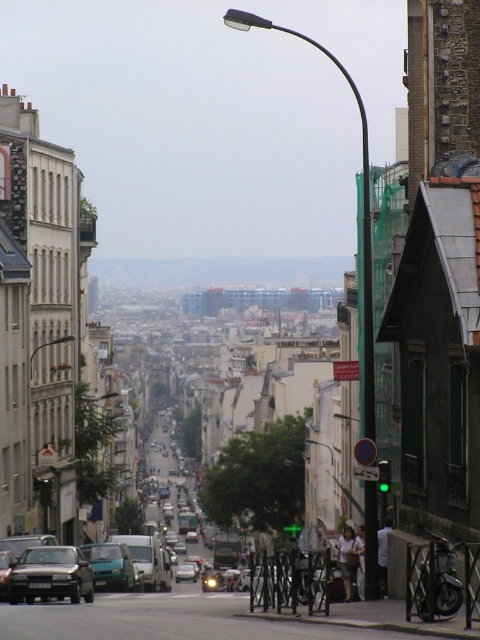
Who is positioned more to the left, black matte car at center or teal matte van at center?

black matte car at center is more to the left.

Identify the location of black matte car at center. (50, 576).

Between point (87, 556) and point (192, 580), which one is positioned behind?

Point (192, 580)

Does teal matte van at center come behind silver metallic car at center?

No, it is in front of silver metallic car at center.

Where is `teal matte van at center`? The width and height of the screenshot is (480, 640). teal matte van at center is located at coordinates (110, 566).

Where is `teal matte van at center`? This screenshot has height=640, width=480. teal matte van at center is located at coordinates (110, 566).

Does point (15, 582) lie in front of point (196, 576)?

Yes, it is in front of point (196, 576).

Can you confirm if black matte car at center is positioned below silver metallic car at center?

No.

Which is in front, point (41, 552) or point (194, 576)?

Point (41, 552) is in front.

This screenshot has height=640, width=480. In order to click on black matte car at center in this screenshot , I will do `click(50, 576)`.